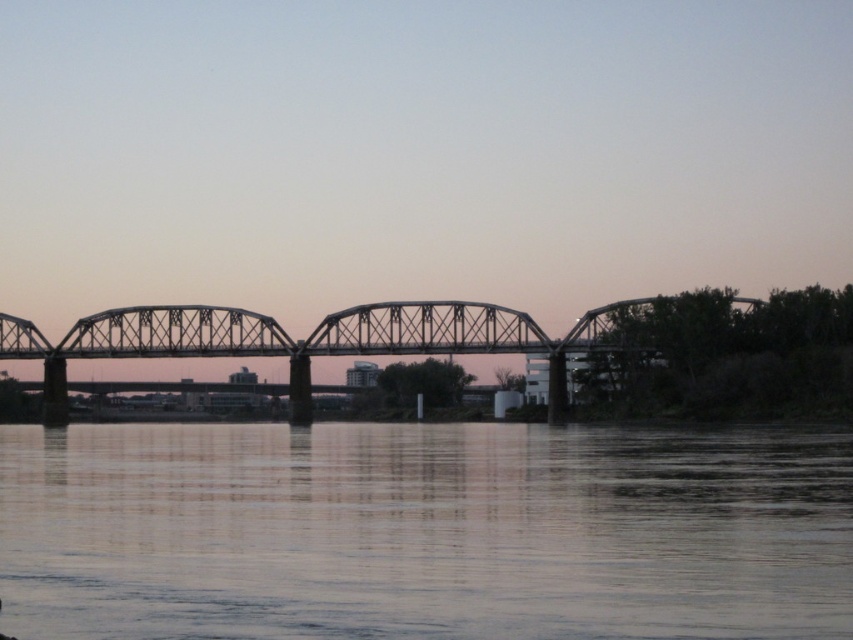
Question: From the image, what is the correct spatial relationship of smooth water at center in relation to metallic bridge at center?

Choices:
 (A) right
 (B) left

Answer: (B)

Question: Can you confirm if smooth water at center is bigger than metallic bridge at center?

Choices:
 (A) no
 (B) yes

Answer: (B)

Question: From the image, what is the correct spatial relationship of smooth water at center in relation to metallic bridge at center?

Choices:
 (A) right
 (B) left

Answer: (B)